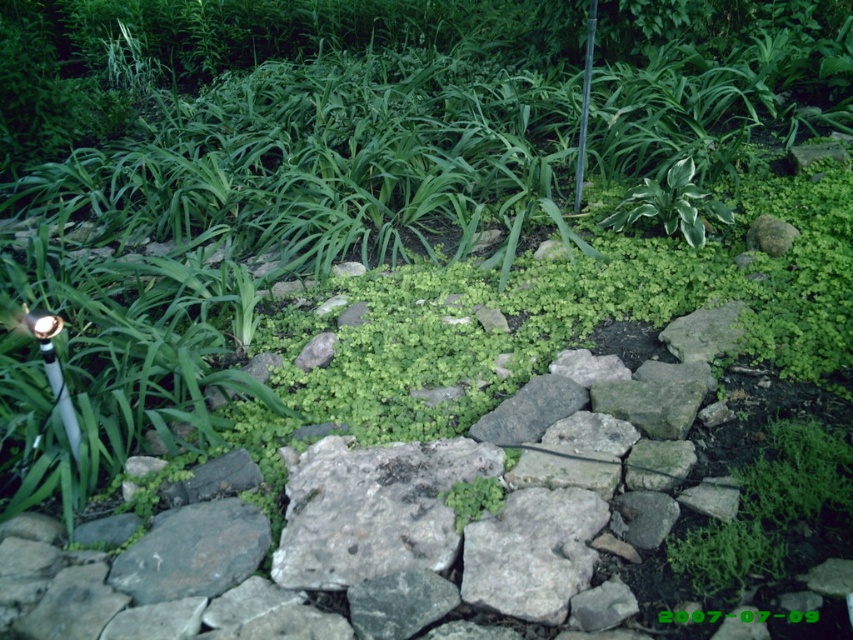
In the scene shown: Is gray rough rock at center positioned before white-green leafy plant at upper right?

Yes, gray rough rock at center is in front of white-green leafy plant at upper right.

Can you confirm if gray rough rock at center is positioned below white-green leafy plant at upper right?

Yes, gray rough rock at center is below white-green leafy plant at upper right.

Is point (204, 502) farther from viewer compared to point (677, 220)?

No, (204, 502) is in front of (677, 220).

The width and height of the screenshot is (853, 640). I want to click on gray rough rock at center, so (193, 552).